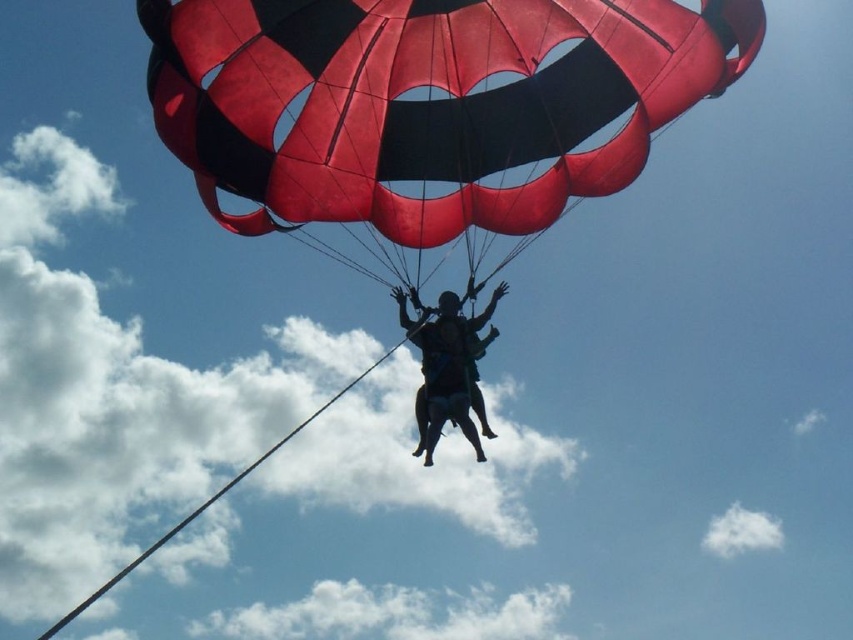
Question: Is red/black parachute at upper center to the left of black matte parachute at center from the viewer's perspective?

Choices:
 (A) yes
 (B) no

Answer: (B)

Question: Which point is closer to the camera?

Choices:
 (A) (434, 378)
 (B) (479, 4)

Answer: (B)

Question: Which point is closer to the camera?

Choices:
 (A) black matte parachute at center
 (B) red/black parachute at upper center

Answer: (B)

Question: Does red/black parachute at upper center lie in front of black matte parachute at center?

Choices:
 (A) no
 (B) yes

Answer: (B)

Question: Is the position of red/black parachute at upper center less distant than that of black matte parachute at center?

Choices:
 (A) no
 (B) yes

Answer: (B)